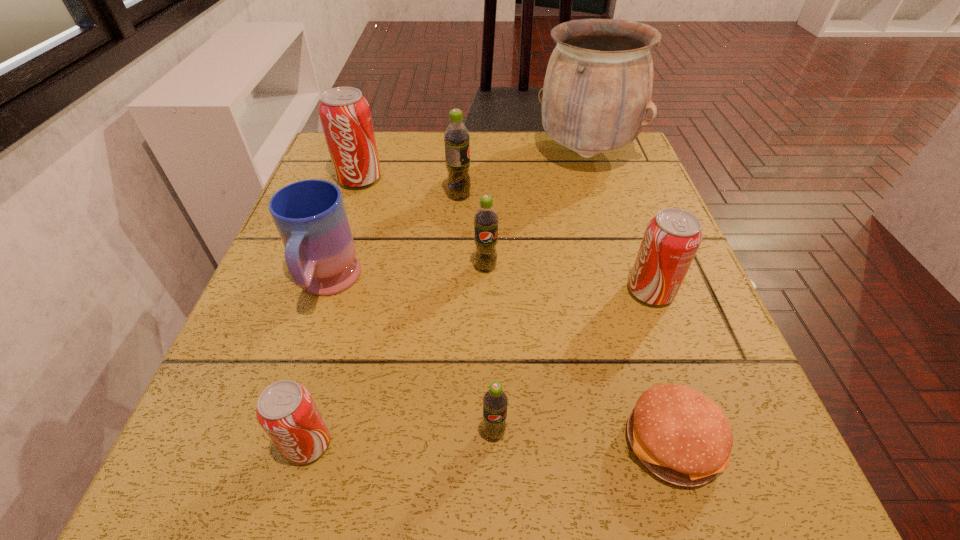
Locate which red soda can is the second closest to the farthest green soda. Please provide its 2D coordinates. Your answer should be formatted as a tuple, i.e. [(x, y)], where the tuple contains the x and y coordinates of a point satisfying the conditions above.

[(671, 239)]

Locate which red soda can ranks in proximity to the nearest red soda can. Please provide its 2D coordinates. Your answer should be formatted as a tuple, i.e. [(x, y)], where the tuple contains the x and y coordinates of a point satisfying the conditions above.

[(671, 239)]

Find the location of a particular element. green soda that is the nearest to the smallest red soda can is located at coordinates (495, 401).

Choose which green soda is the second nearest neighbor to the nearest green soda. Please provide its 2D coordinates. Your answer should be formatted as a tuple, i.e. [(x, y)], where the tuple contains the x and y coordinates of a point satisfying the conditions above.

[(456, 137)]

Locate an element on the screen. The height and width of the screenshot is (540, 960). vacant space that satisfies the following two spatial constraints: 1. on the front label of the second nearest green soda; 2. on the right side of the shortest object is located at coordinates (488, 442).